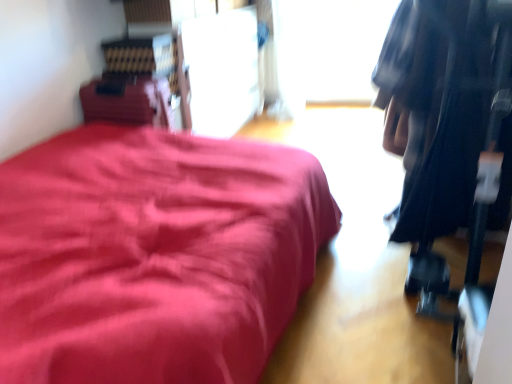
Question: Visually, is black fabric bag at right positioned to the left or to the right of matte red bed at left?

Choices:
 (A) right
 (B) left

Answer: (A)

Question: From their relative heights in the image, would you say black fabric bag at right is taller or shorter than matte red bed at left?

Choices:
 (A) tall
 (B) short

Answer: (A)

Question: Which is nearer to the black fabric bag at right?

Choices:
 (A) transparent glass window at upper center
 (B) matte red bed at left

Answer: (B)

Question: Considering the real-world distances, which object is closest to the matte red bed at left?

Choices:
 (A) transparent glass window at upper center
 (B) black fabric bag at right

Answer: (B)